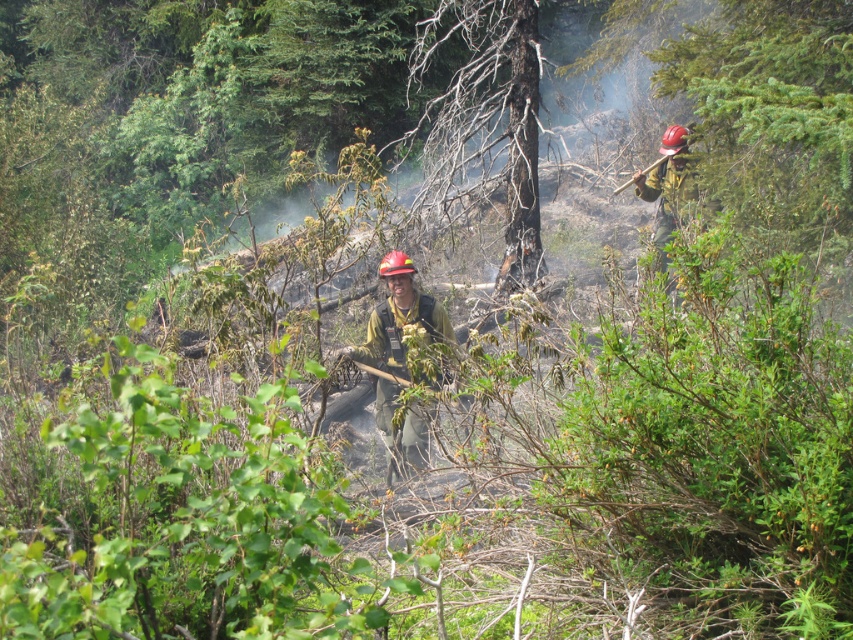
Is matte green uniform at center closer to camera compared to hardened plastic helmet at upper right?

That is True.

Is point (427, 314) positioned before point (668, 230)?

Yes, point (427, 314) is closer to viewer.

Find the location of a particular element. This screenshot has width=853, height=640. matte green uniform at center is located at coordinates (399, 317).